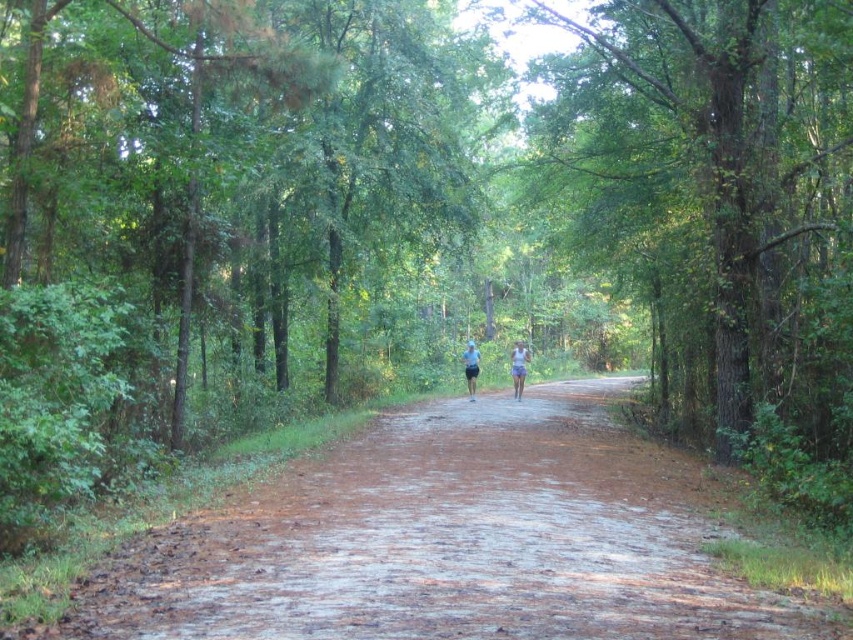
Question: Is brown dirt road at center to the left of white fabric shorts at center from the viewer's perspective?

Choices:
 (A) yes
 (B) no

Answer: (A)

Question: Is brown dirt road at center to the right of green leafy tree at center from the viewer's perspective?

Choices:
 (A) yes
 (B) no

Answer: (B)

Question: Considering the real-world distances, which object is closest to the brown dirt road at center?

Choices:
 (A) green leafy tree at center
 (B) white fabric shirt at center
 (C) white fabric shorts at center

Answer: (A)

Question: Does green leafy tree at center appear on the right side of white fabric shorts at center?

Choices:
 (A) yes
 (B) no

Answer: (A)

Question: Which point is farther to the camera?

Choices:
 (A) light blue fabric shorts at center
 (B) brown dirt road at center
 (C) white fabric shorts at center
 (D) white fabric shirt at center

Answer: (D)

Question: Which is farther from the white fabric shirt at center?

Choices:
 (A) white fabric shorts at center
 (B) green leafy tree at center
 (C) brown dirt road at center

Answer: (C)